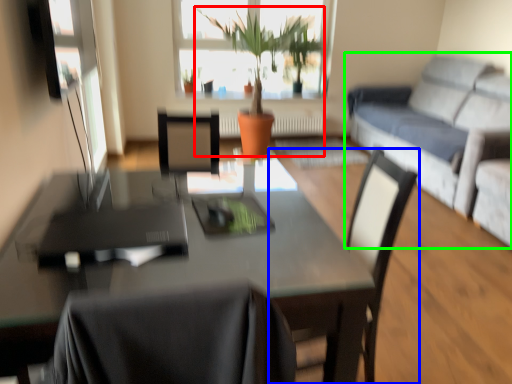
Question: Which is nearer to the houseplant (highlighted by a red box)? chair (highlighted by a blue box) or studio couch (highlighted by a green box).

Choices:
 (A) chair
 (B) studio couch

Answer: (B)